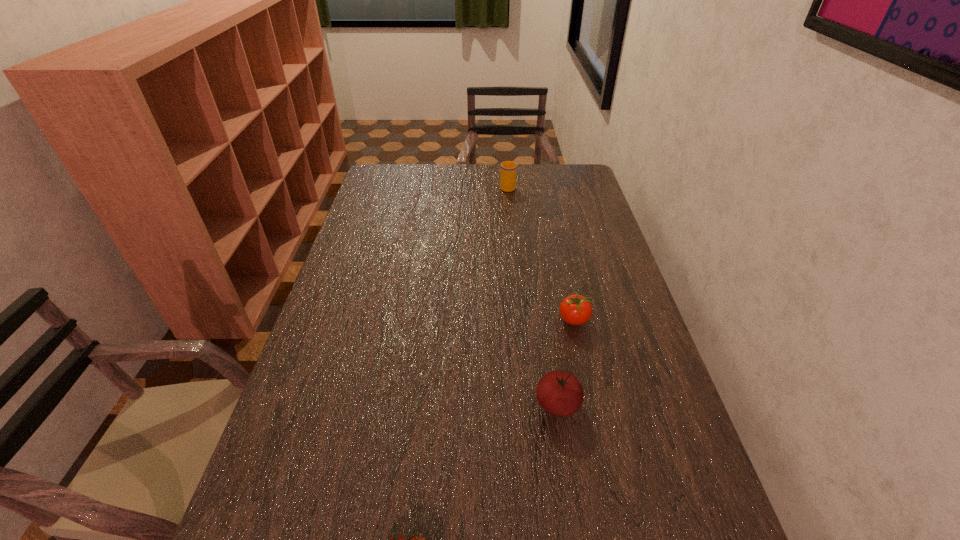
At what (x,y) coordinates should I click in order to perform the action: click on free region at the left edge of the desktop. Please return your answer as a coordinate pair (x, y). Looking at the image, I should click on (321, 400).

Locate an element on the screen. The width and height of the screenshot is (960, 540). free space at the right edge is located at coordinates tap(569, 224).

You are a GUI agent. You are given a task and a screenshot of the screen. Output one action in this format:
    pyautogui.click(x=<x>, y=<y>)
    Task: Click on the free space at the far left corner of the desktop
    Image resolution: width=960 pixels, height=540 pixels.
    Given the screenshot: What is the action you would take?
    pyautogui.click(x=367, y=189)

Where is `free space between the third farthest object and the farthest object`? Image resolution: width=960 pixels, height=540 pixels. free space between the third farthest object and the farthest object is located at coordinates (533, 295).

This screenshot has width=960, height=540. I want to click on vacant area that lies between the tallest tomato and the farthest object, so click(533, 295).

I want to click on free space between the second farthest object and the farthest object, so click(540, 253).

Where is `free spot between the farthest tomato and the cup`? free spot between the farthest tomato and the cup is located at coordinates (540, 253).

This screenshot has height=540, width=960. In order to click on free space between the second farthest object and the cup in this screenshot , I will do `click(540, 253)`.

The width and height of the screenshot is (960, 540). Find the location of `the third closest object to the tallest tomato`. the third closest object to the tallest tomato is located at coordinates (508, 168).

Identify which object is the second closest to the second farthest tomato. Please provide its 2D coordinates. Your answer should be formatted as a tuple, i.e. [(x, y)], where the tuple contains the x and y coordinates of a point satisfying the conditions above.

[(410, 539)]